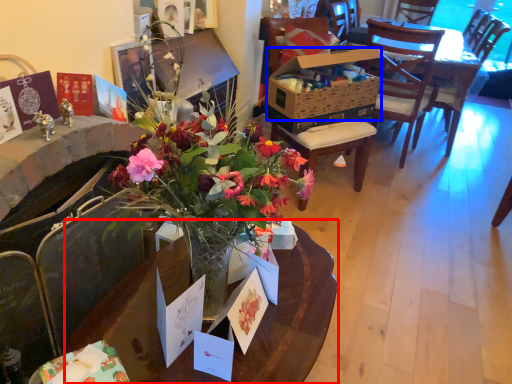
Question: Which object is closer to the camera taking this photo, kitchen & dining room table (highlighted by a red box) or box (highlighted by a blue box)?

Choices:
 (A) kitchen & dining room table
 (B) box

Answer: (A)